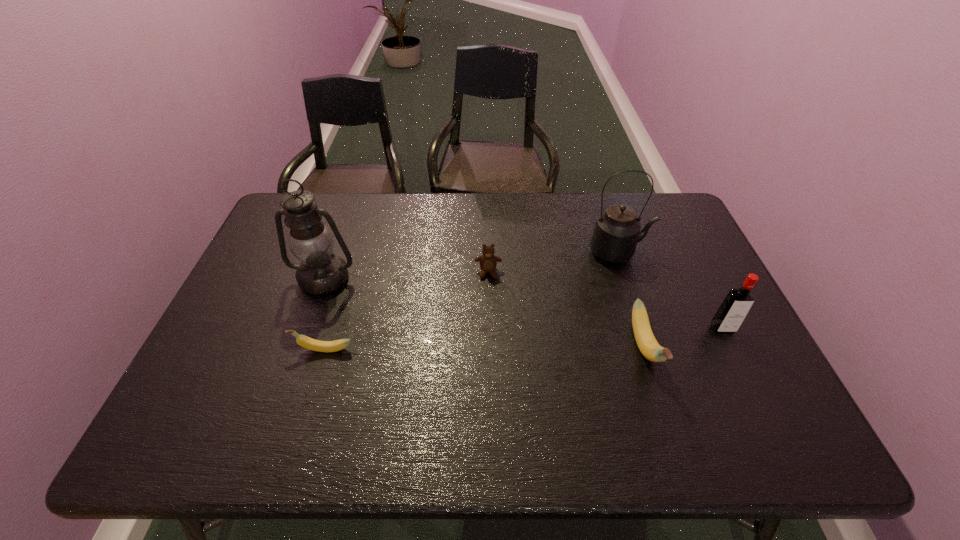
At what (x,y) coordinates should I click in order to perform the action: click on vacant point that satisfies the following two spatial constraints: 1. spout on the kettle; 2. at the face of the fourth object from right to left. Please return your answer as a coordinate pair (x, y). This screenshot has height=540, width=960. Looking at the image, I should click on (626, 272).

Find the location of a particular element. The width and height of the screenshot is (960, 540). free space in the image that satisfies the following two spatial constraints: 1. spout on the second tallest object; 2. at the face of the fourth object from right to left is located at coordinates (626, 272).

Identify the location of vacant space that satisfies the following two spatial constraints: 1. at the stem of the right banana; 2. at the stem of the left banana. The width and height of the screenshot is (960, 540). (645, 349).